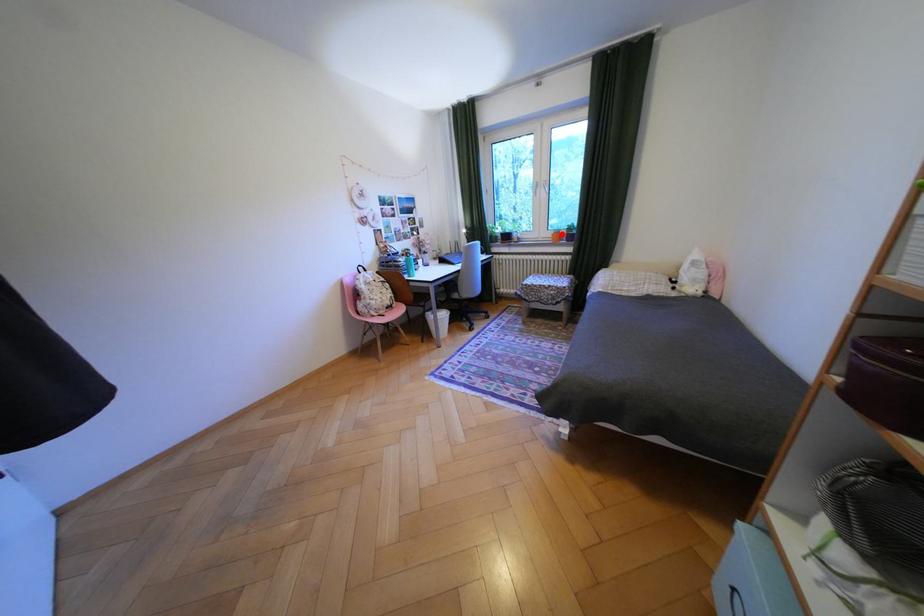
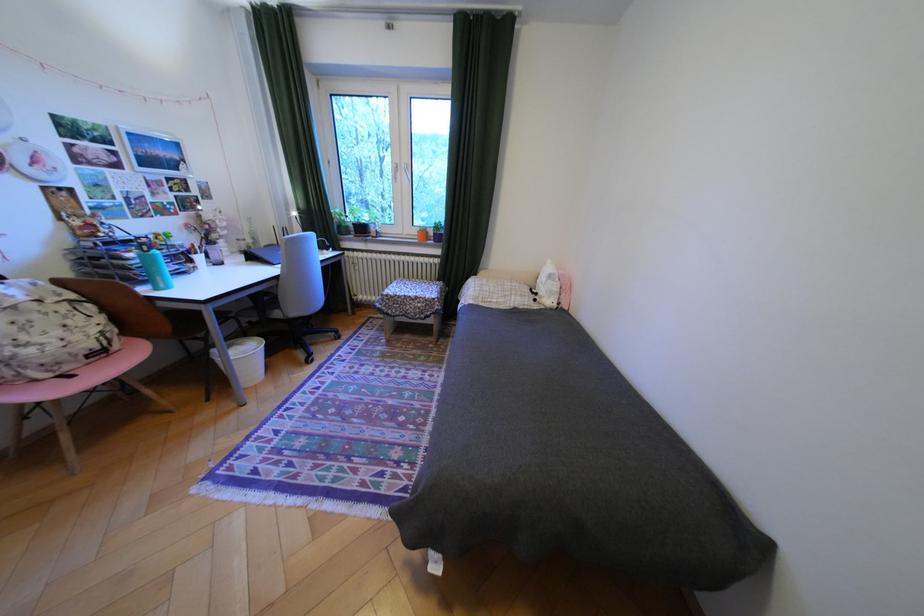
Question: I am providing you with two images of the same scene from different viewpoints. Given a red point in image1, look at the same physical point in image2. Is it:

Choices:
 (A) Closer to the viewpoint
 (B) Farther from the viewpoint

Answer: (B)